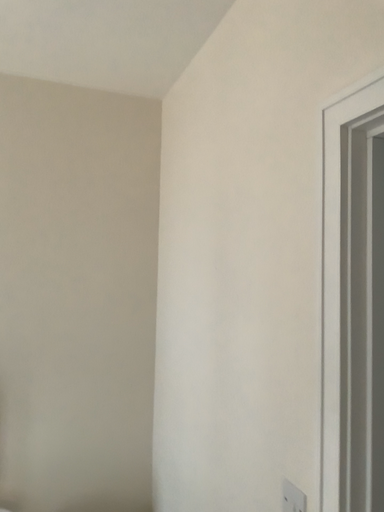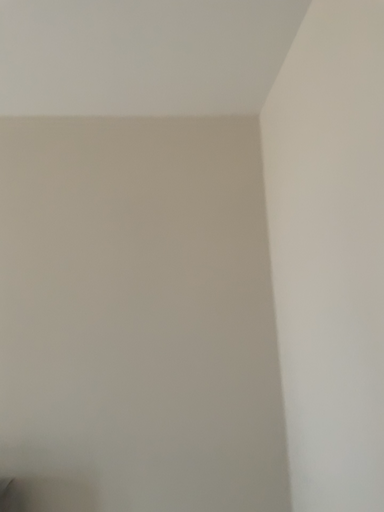
Question: Which way did the camera rotate in the video?

Choices:
 (A) rotated left
 (B) rotated right

Answer: (A)